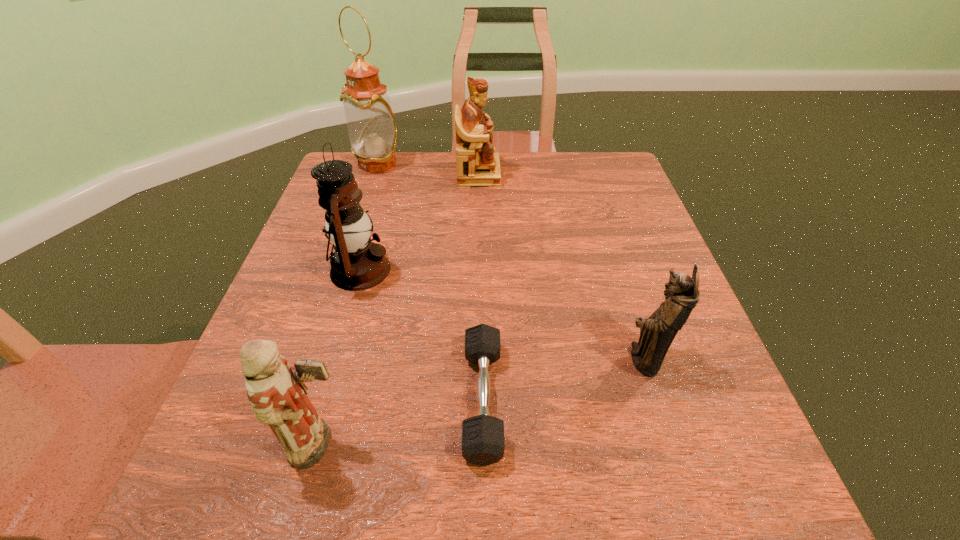
The width and height of the screenshot is (960, 540). I want to click on empty location between the nearest figurine and the dumbbell, so click(x=402, y=422).

Identify the location of object that stands as the second closest to the lantern. The image size is (960, 540). (276, 391).

This screenshot has height=540, width=960. What are the coordinates of `object that is the third closest one to the nearest figurine` in the screenshot? It's located at (657, 332).

The image size is (960, 540). Identify the location of the third closest figurine to the shortest object. (478, 165).

Identify the location of the second closest figurine to the tallest object. (276, 391).

Where is `vacant region that satisfies the following two spatial constraints: 1. on the side of the lantern, there is a wick adjustment knob; 2. on the left side of the dumbbell`? Image resolution: width=960 pixels, height=540 pixels. vacant region that satisfies the following two spatial constraints: 1. on the side of the lantern, there is a wick adjustment knob; 2. on the left side of the dumbbell is located at coordinates (324, 399).

This screenshot has height=540, width=960. In order to click on vacant area that satisfies the following two spatial constraints: 1. on the side of the fourth nearest object, there is a wick adjustment knob; 2. on the left side of the dumbbell in this screenshot , I will do `click(324, 399)`.

Image resolution: width=960 pixels, height=540 pixels. Find the location of `vacant space that satisfies the following two spatial constraints: 1. on the front-facing side of the dumbbell; 2. on the right side of the farthest figurine`. vacant space that satisfies the following two spatial constraints: 1. on the front-facing side of the dumbbell; 2. on the right side of the farthest figurine is located at coordinates (478, 399).